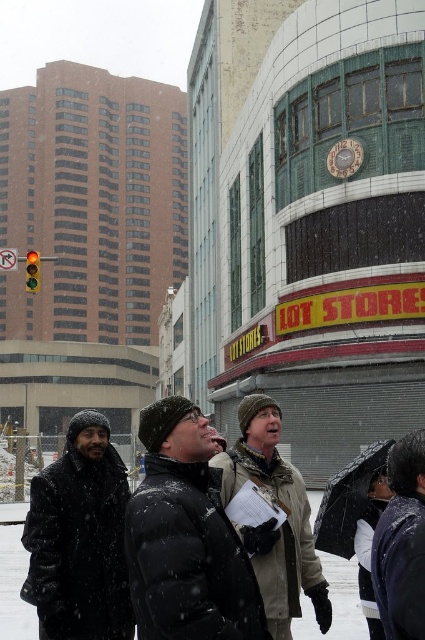
You are a delivery person trying to locate the black matte jacket at center in a snowy urban scene. The coordinates provided are point (186, 538). Can you confirm if this point corresponds to the location of the black matte jacket at center?

Yes, the point (186, 538) indicates the black matte jacket at center, so this is the correct location.

You are standing at the position of the dark gray woolen hat at lower left and want to throw a snowball to the khaki wool jacket at center. Can you reach them with a single throw if your maximum throwing distance is 4 meters?

The dark gray woolen hat at lower left is 4.63 meters from the khaki wool jacket at center. Since your maximum throwing distance is 4 meters, you cannot reach them with a single throw.